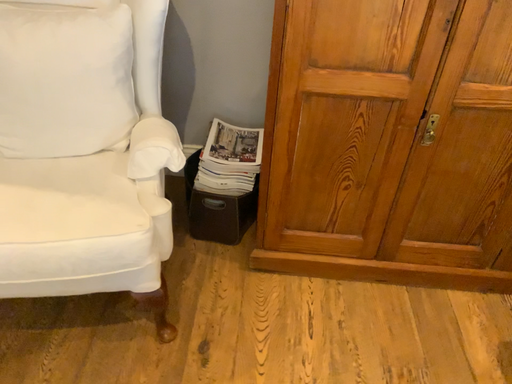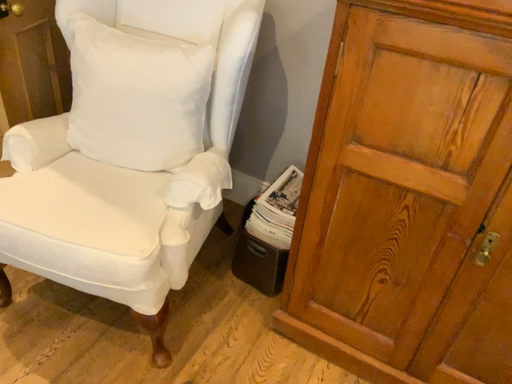
Question: Which way did the camera rotate in the video?

Choices:
 (A) rotated upward
 (B) rotated downward

Answer: (A)